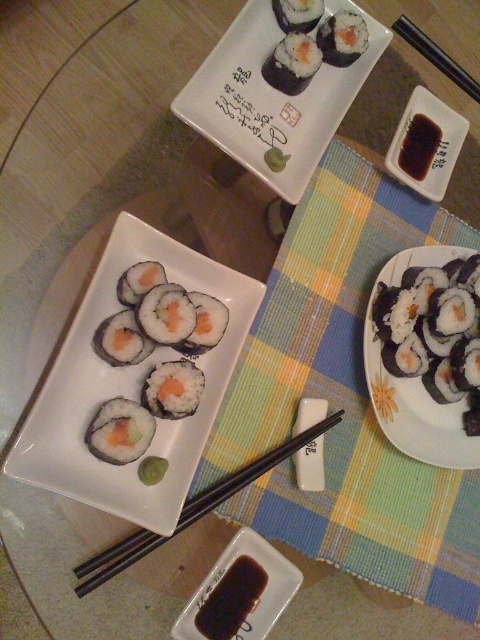
Question: Which object is farther from the camera taking this photo?

Choices:
 (A) black plastic chopsticks at center
 (B) white glossy plate at center

Answer: (A)

Question: Which point is farther to the camera?

Choices:
 (A) (32, 476)
 (B) (310, 68)
 (C) (450, 76)
 (D) (84, 570)

Answer: (C)

Question: Is black matte sushi rolls at center closer to camera compared to black plastic chopsticks at upper right?

Choices:
 (A) yes
 (B) no

Answer: (A)

Question: Which object is positioned closest to the soy sauce at upper right?

Choices:
 (A) black plastic chopsticks at upper right
 (B) white glossy rectangular plate at upper center
 (C) slightly translucent white rice at upper center

Answer: (A)

Question: Does white glossy plate at center come in front of green rice roll at center?

Choices:
 (A) yes
 (B) no

Answer: (A)

Question: Is white glossy plate at center closer to camera compared to black plastic chopsticks at upper right?

Choices:
 (A) yes
 (B) no

Answer: (A)